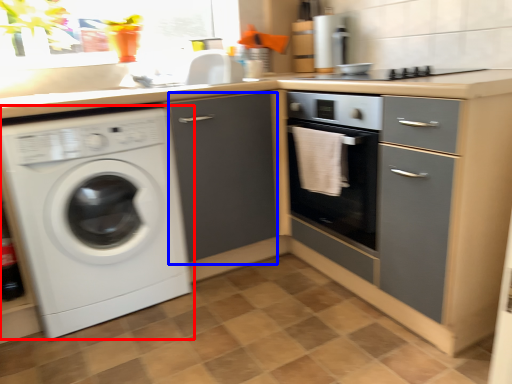
Question: Among these objects, which one is farthest to the camera, washing machine (highlighted by a red box) or file cabinet (highlighted by a blue box)?

Choices:
 (A) washing machine
 (B) file cabinet

Answer: (B)